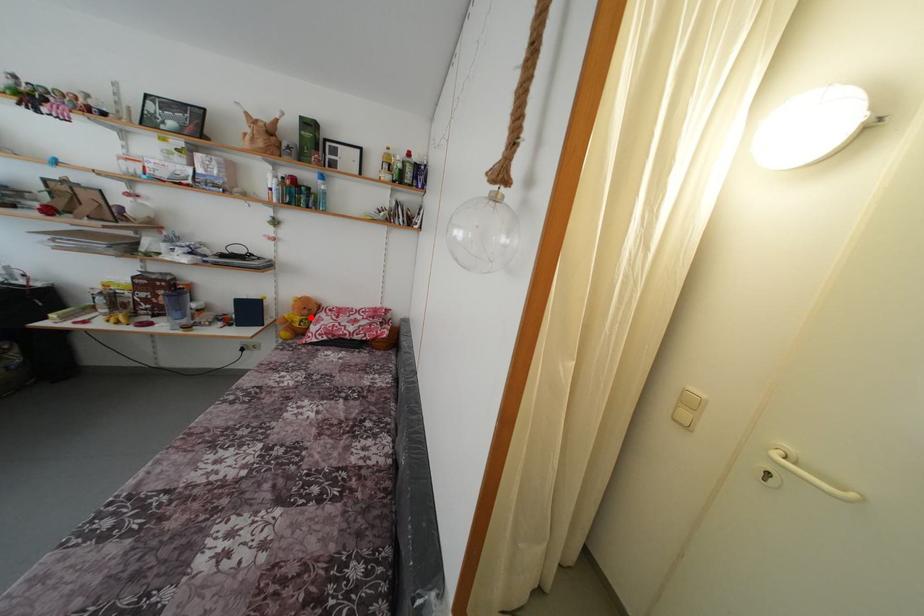
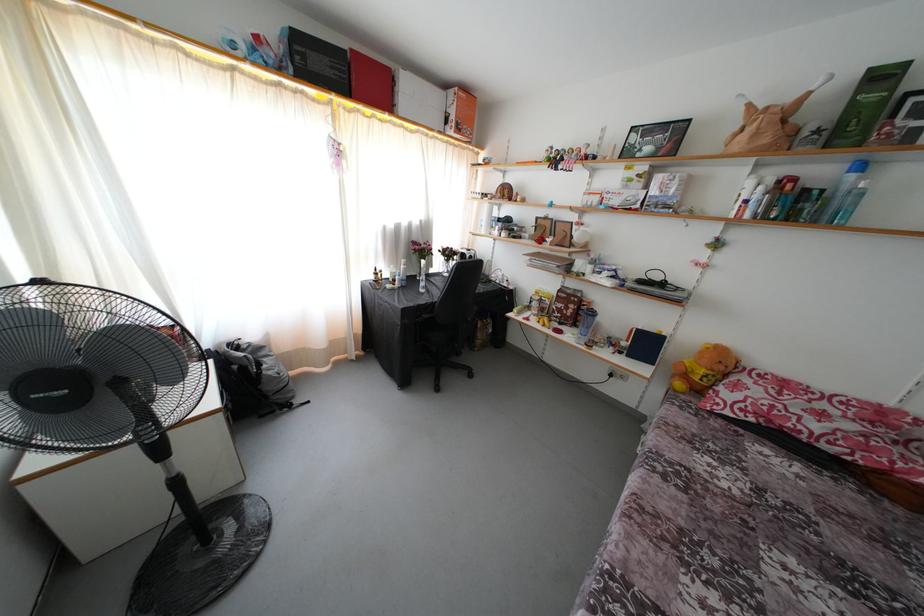
In the second image, find the point that corresponds to the highlighted location in the first image.

(726, 373)